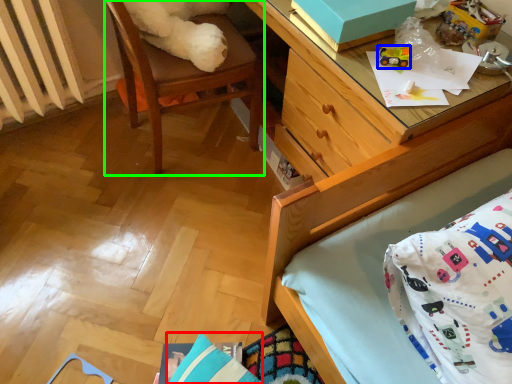
Question: Which object is the closest to the pillow (highlighted by a red box)? Choose among these: toy (highlighted by a blue box) or chair (highlighted by a green box).

Choices:
 (A) toy
 (B) chair

Answer: (B)